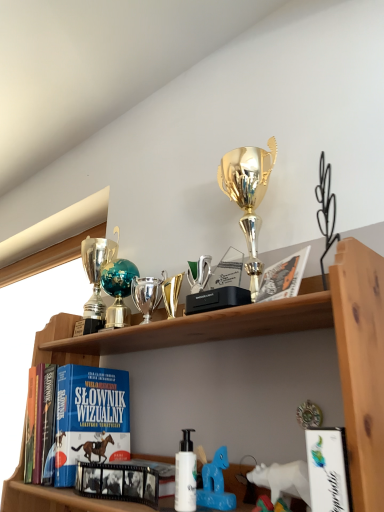
The width and height of the screenshot is (384, 512). I want to click on blue hardcover book at lower left, acting as the 1th book starting from the left, so click(x=90, y=418).

Describe the element at coordinates (118, 482) in the screenshot. Image resolution: width=384 pixels, height=512 pixels. I see `black glossy film strip at center, placed as the 2th book when sorted from left to right` at that location.

Where is `black glossy film strip at center, arranged as the 2th book when viewed from the front`? The width and height of the screenshot is (384, 512). black glossy film strip at center, arranged as the 2th book when viewed from the front is located at coordinates (118, 482).

This screenshot has width=384, height=512. In order to click on white matte bottle at center in this screenshot , I will do `click(185, 474)`.

Locate an element on the screen. the 2nd book in front when counting from the shiny silver trophy at center, which appears as the 2th toy when viewed from the back is located at coordinates (118, 482).

Is the surface of black glossy film strip at center, which is counted as the second book, starting from the back, in direct contact with shiny silver trophy at center, marked as the second toy in a front-to-back arrangement?

No, black glossy film strip at center, which is counted as the second book, starting from the back, is not making contact with shiny silver trophy at center, marked as the second toy in a front-to-back arrangement.

Between black glossy film strip at center, the second book viewed from the right, and shiny silver trophy at center, which is counted as the third toy, starting from the bottom, which one has more height?

shiny silver trophy at center, which is counted as the third toy, starting from the bottom, is taller.

Which object is thinner, black glossy film strip at center, placed as the 2th book when sorted from left to right, or shiny silver trophy at center, marked as the second toy in a front-to-back arrangement?

black glossy film strip at center, placed as the 2th book when sorted from left to right.

Between teal glass globe at upper center, the third toy positioned from the front, and white glossy book at lower right, marked as the 3th book in a back-to-front arrangement, which one appears on the right side from the viewer's perspective?

white glossy book at lower right, marked as the 3th book in a back-to-front arrangement.

Considering the sizes of objects teal glass globe at upper center, which is counted as the second toy, starting from the top, and white glossy book at lower right, marked as the 3th book in a back-to-front arrangement, in the image provided, who is bigger, teal glass globe at upper center, which is counted as the second toy, starting from the top, or white glossy book at lower right, marked as the 3th book in a back-to-front arrangement,?

teal glass globe at upper center, which is counted as the second toy, starting from the top.

Is teal glass globe at upper center, which ranks as the 2th toy in bottom-to-top order, taller than white glossy book at lower right, the 1th book viewed from the front?

Yes.

Choose the correct answer: Is teal glass globe at upper center, the 3th toy viewed from the right, inside white glossy book at lower right, the 1th book viewed from the front, or outside it?

teal glass globe at upper center, the 3th toy viewed from the right, is located beyond the bounds of white glossy book at lower right, the 1th book viewed from the front.

Looking at this image, is white plastic toy horse at lower center, marked as the 3th toy in a left-to-right arrangement, beside white matte bottle at center?

They are not placed beside each other.

Considering the relative sizes of white plastic toy horse at lower center, marked as the 3th toy in a left-to-right arrangement, and white matte bottle at center in the image provided, is white plastic toy horse at lower center, marked as the 3th toy in a left-to-right arrangement, smaller than white matte bottle at center?

Incorrect, white plastic toy horse at lower center, marked as the 3th toy in a left-to-right arrangement, is not smaller in size than white matte bottle at center.

Is white plastic toy horse at lower center, marked as the 1th toy in a bottom-to-top arrangement, outside of white matte bottle at center?

Yes, white plastic toy horse at lower center, marked as the 1th toy in a bottom-to-top arrangement, is located beyond the bounds of white matte bottle at center.

In the scene shown: Which object is positioned more to the right, white plastic toy horse at lower center, the first toy positioned from the front, or white matte bottle at center?

Positioned to the right is white plastic toy horse at lower center, the first toy positioned from the front.

Which of these two, white plastic toy horse at lower center, the first toy positioned from the front, or teal glass globe at upper center, which is counted as the second toy, starting from the top, stands shorter?

white plastic toy horse at lower center, the first toy positioned from the front.

Consider the image. Considering the sizes of objects white plastic toy horse at lower center, marked as the 3th toy in a left-to-right arrangement, and teal glass globe at upper center, arranged as the 1th toy when viewed from the left, in the image provided, who is thinner, white plastic toy horse at lower center, marked as the 3th toy in a left-to-right arrangement, or teal glass globe at upper center, arranged as the 1th toy when viewed from the left,?

white plastic toy horse at lower center, marked as the 3th toy in a left-to-right arrangement.

Is white plastic toy horse at lower center, marked as the 1th toy in a bottom-to-top arrangement, positioned beyond the bounds of teal glass globe at upper center, the third toy positioned from the front?

Yes.

Does blue hardcover book at lower left, the third book positioned from the right, have a greater height compared to black glossy film strip at center, which is counted as the second book, starting from the back?

Yes, blue hardcover book at lower left, the third book positioned from the right, is taller than black glossy film strip at center, which is counted as the second book, starting from the back.

In the scene shown: Considering the sizes of objects blue hardcover book at lower left, arranged as the 3th book when viewed from the front, and black glossy film strip at center, which is counted as the second book, starting from the back, in the image provided, who is thinner, blue hardcover book at lower left, arranged as the 3th book when viewed from the front, or black glossy film strip at center, which is counted as the second book, starting from the back,?

black glossy film strip at center, which is counted as the second book, starting from the back, is thinner.

From the blue hardcover book at lower left, which is counted as the first book, starting from the back, count 1st books forward and point to it. Please provide its 2D coordinates.

[(118, 482)]

From a real-world perspective, is black glossy film strip at center, which is counted as the second book, starting from the back, physically located above or below blue hardcover book at lower left, which is counted as the first book, starting from the back?

black glossy film strip at center, which is counted as the second book, starting from the back, is below blue hardcover book at lower left, which is counted as the first book, starting from the back.

Which is behind, point (87, 465) or point (102, 460)?

The point (102, 460) is more distant.

Looking at this image, from the image's perspective, which one is positioned lower, black glossy film strip at center, arranged as the 2th book when viewed from the front, or blue hardcover book at lower left, which is counted as the first book, starting from the back?

From the image's view, black glossy film strip at center, arranged as the 2th book when viewed from the front, is below.

Considering the relative positions of black glossy film strip at center, the second book viewed from the right, and blue hardcover book at lower left, arranged as the 3th book when viewed from the front, in the image provided, is black glossy film strip at center, the second book viewed from the right, to the left or to the right of blue hardcover book at lower left, arranged as the 3th book when viewed from the front,?

In the image, black glossy film strip at center, the second book viewed from the right, appears on the right side of blue hardcover book at lower left, arranged as the 3th book when viewed from the front.

Who is smaller, white glossy book at lower right, marked as the 3th book in a back-to-front arrangement, or shiny silver trophy at center, which appears as the second toy when viewed from the right?

Smaller between the two is white glossy book at lower right, marked as the 3th book in a back-to-front arrangement.

Is white glossy book at lower right, marked as the 3th book in a back-to-front arrangement, directly adjacent to shiny silver trophy at center, acting as the 1th toy starting from the top?

white glossy book at lower right, marked as the 3th book in a back-to-front arrangement, and shiny silver trophy at center, acting as the 1th toy starting from the top, are not in contact.

Is white glossy book at lower right, the first book from the right, to the left of shiny silver trophy at center, which appears as the second toy when viewed from the right, from the viewer's perspective?

In fact, white glossy book at lower right, the first book from the right, is to the right of shiny silver trophy at center, which appears as the second toy when viewed from the right.

You are a GUI agent. You are given a task and a screenshot of the screen. Output one action in this format:
    pyautogui.click(x=<x>, y=<y>)
    Task: Click on the 2nd book in front of the shiny silver trophy at center, which appears as the second toy when viewed from the right, counting from the anchor's position
    
    Given the screenshot: What is the action you would take?
    pyautogui.click(x=118, y=482)

From the image's perspective, starting from the white glossy book at lower right, marked as the 3th book in a back-to-front arrangement, which toy is the 1st one above? Please provide its 2D coordinates.

[(118, 291)]

Based on their spatial positions, is white plastic toy horse at lower center, marked as the 1th toy in a bottom-to-top arrangement, or white matte bottle at center further from blue hardcover book at lower left, which is counted as the first book, starting from the back?

white plastic toy horse at lower center, marked as the 1th toy in a bottom-to-top arrangement, lies further to blue hardcover book at lower left, which is counted as the first book, starting from the back, than the other object.

Estimate the real-world distances between objects in this image. Which object is closer to blue hardcover book at lower left, which is counted as the first book, starting from the back, white matte bottle at center or white glossy book at lower right, which is the third book in left-to-right order?

white matte bottle at center.

Which object lies further to the anchor point blue hardcover book at lower left, arranged as the 3th book when viewed from the front, teal glass globe at upper center, the third toy positioned from the front, or white glossy book at lower right, marked as the 3th book in a back-to-front arrangement?

white glossy book at lower right, marked as the 3th book in a back-to-front arrangement, is positioned further to the anchor blue hardcover book at lower left, arranged as the 3th book when viewed from the front.

Looking at the image, which one is located closer to white plastic toy horse at lower center, the first toy positioned from the front, white glossy book at lower right, marked as the 3th book in a back-to-front arrangement, or blue hardcover book at lower left, the third book positioned from the right?

The object closer to white plastic toy horse at lower center, the first toy positioned from the front, is white glossy book at lower right, marked as the 3th book in a back-to-front arrangement.

Considering their positions, is shiny silver trophy at center, which appears as the second toy when viewed from the right, positioned further to black glossy film strip at center, the second book viewed from the right, than white glossy book at lower right, the 1th book viewed from the front?

shiny silver trophy at center, which appears as the second toy when viewed from the right.

From the image, which object appears to be nearer to white glossy book at lower right, the 1th book viewed from the front, black glossy film strip at center, which is counted as the second book, starting from the back, or blue hardcover book at lower left, the third book positioned from the right?

Based on the image, black glossy film strip at center, which is counted as the second book, starting from the back, appears to be nearer to white glossy book at lower right, the 1th book viewed from the front.

From the image, which object appears to be nearer to blue hardcover book at lower left, arranged as the 3th book when viewed from the front, white glossy book at lower right, the 1th book viewed from the front, or white plastic toy horse at lower center, marked as the 3th toy in a left-to-right arrangement?

white plastic toy horse at lower center, marked as the 3th toy in a left-to-right arrangement, is closer to blue hardcover book at lower left, arranged as the 3th book when viewed from the front.

Estimate the real-world distances between objects in this image. Which object is closer to white plastic toy horse at lower center, the third toy in the top-to-bottom sequence, shiny silver trophy at center, which appears as the 2th toy when viewed from the back, or white matte bottle at center?

white matte bottle at center is closer to white plastic toy horse at lower center, the third toy in the top-to-bottom sequence.

This screenshot has width=384, height=512. I want to click on bottle between black glossy film strip at center, which is counted as the second book, starting from the back, and white glossy book at lower right, the first book from the right, so click(185, 474).

Identify the location of bottle located between white glossy book at lower right, the 1th book viewed from the front, and shiny silver trophy at center, which appears as the second toy when viewed from the right, in the depth direction. Image resolution: width=384 pixels, height=512 pixels. (185, 474).

Where is `book between blue hardcover book at lower left, acting as the 1th book starting from the left, and white plastic toy horse at lower center, the first toy positioned from the front, in the horizontal direction`? This screenshot has height=512, width=384. book between blue hardcover book at lower left, acting as the 1th book starting from the left, and white plastic toy horse at lower center, the first toy positioned from the front, in the horizontal direction is located at coordinates (118, 482).

Locate an element on the screen. The height and width of the screenshot is (512, 384). toy between white glossy book at lower right, which is the third book in left-to-right order, and white matte bottle at center in the front-back direction is located at coordinates (283, 479).